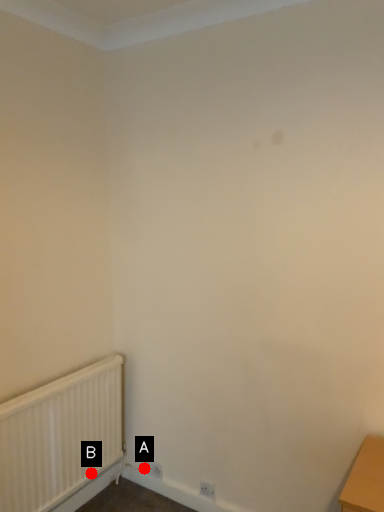
Question: Two points are circled on the image, labeled by A and B beside each circle. Which point appears closest to the camera in this image?

Choices:
 (A) A is closer
 (B) B is closer

Answer: (B)